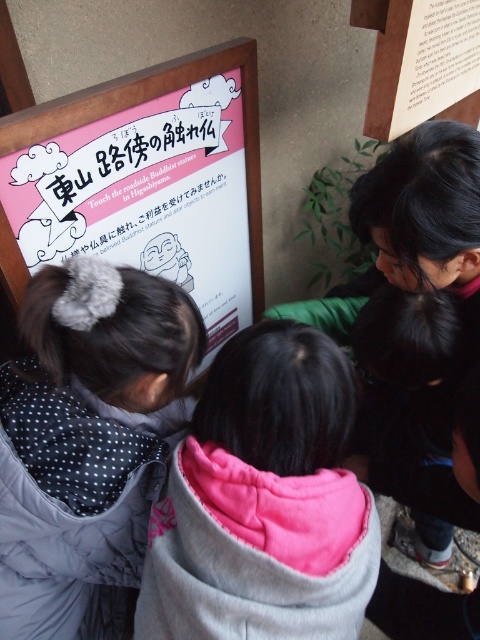
You are trying to decide which item to take with you for warmth. Based on the scene, which object is more suitable for keeping warm between the pink fleece jacket at center and the pink paper sign at upper left?

The pink fleece jacket at center is more suitable for keeping warm because it is thicker than the pink paper sign at upper left.

You are standing in front of the signboard and want to touch the pink fleece jacket at center. Is it possible to reach it without moving closer?

The pink fleece jacket at center is 25.47 inches away from the viewer. Since this distance is within typical arm reach, you can likely touch it without moving closer.